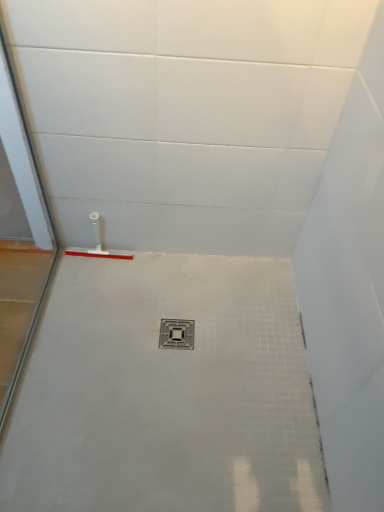
Locate an element on the screen. white plastic squeegee at left is located at coordinates [98, 244].

What do you see at coordinates (98, 244) in the screenshot? I see `white plastic squeegee at left` at bounding box center [98, 244].

The image size is (384, 512). In order to click on metallic gray drain at center in this screenshot , I will do `click(176, 334)`.

Describe the element at coordinates (176, 334) in the screenshot. I see `metallic gray drain at center` at that location.

This screenshot has height=512, width=384. In order to click on white plastic squeegee at left in this screenshot , I will do `click(98, 244)`.

Which object is positioned more to the left, metallic gray drain at center or white plastic squeegee at left?

white plastic squeegee at left.

Who is more distant, metallic gray drain at center or white plastic squeegee at left?

white plastic squeegee at left.

Considering the points (178, 332) and (96, 244), which point is behind, point (178, 332) or point (96, 244)?

The point (96, 244) is more distant.

From the image's perspective, is metallic gray drain at center located above or below white plastic squeegee at left?

metallic gray drain at center is below white plastic squeegee at left.

From a real-world perspective, which is physically above, metallic gray drain at center or white plastic squeegee at left?

In real-world perspective, white plastic squeegee at left is above.

Can you confirm if metallic gray drain at center is thinner than white plastic squeegee at left?

No.

Can you confirm if metallic gray drain at center is taller than white plastic squeegee at left?

No, metallic gray drain at center is not taller than white plastic squeegee at left.

Considering the sizes of objects metallic gray drain at center and white plastic squeegee at left in the image provided, who is bigger, metallic gray drain at center or white plastic squeegee at left?

white plastic squeegee at left is bigger.

Choose the correct answer: Is metallic gray drain at center inside white plastic squeegee at left or outside it?

metallic gray drain at center is spatially situated outside white plastic squeegee at left.

Are metallic gray drain at center and white plastic squeegee at left making contact?

No.

Is white plastic squeegee at left at the back of metallic gray drain at center?

metallic gray drain at center is not turned away from white plastic squeegee at left.

Measure the distance between metallic gray drain at center and white plastic squeegee at left.

A distance of 15.51 inches exists between metallic gray drain at center and white plastic squeegee at left.

You are a GUI agent. You are given a task and a screenshot of the screen. Output one action in this format:
    pyautogui.click(x=<x>, y=<y>)
    Task: Click on the shower behind the metallic gray drain at center
    
    Given the screenshot: What is the action you would take?
    pyautogui.click(x=98, y=244)

Is white plastic squeegee at left at the right side of metallic gray drain at center?

In fact, white plastic squeegee at left is to the left of metallic gray drain at center.

Considering their positions, is white plastic squeegee at left located in front of or behind metallic gray drain at center?

white plastic squeegee at left is positioned farther from the viewer than metallic gray drain at center.

Is point (93, 224) closer to camera compared to point (166, 328)?

No, (93, 224) is behind (166, 328).

From the image's perspective, relative to metallic gray drain at center, is white plastic squeegee at left above or below?

Based on their image positions, white plastic squeegee at left is located above metallic gray drain at center.

From a real-world perspective, is white plastic squeegee at left below metallic gray drain at center?

No.

Considering the relative sizes of white plastic squeegee at left and metallic gray drain at center in the image provided, is white plastic squeegee at left wider than metallic gray drain at center?

Incorrect, the width of white plastic squeegee at left does not surpass that of metallic gray drain at center.

Between white plastic squeegee at left and metallic gray drain at center, which one has more height?

With more height is white plastic squeegee at left.

Is white plastic squeegee at left smaller than metallic gray drain at center?

No.

Is white plastic squeegee at left located outside metallic gray drain at center?

Yes.

Is white plastic squeegee at left next to metallic gray drain at center?

white plastic squeegee at left is not next to metallic gray drain at center, and they're not touching.

Could you tell me if white plastic squeegee at left is facing metallic gray drain at center?

No, white plastic squeegee at left does not turn towards metallic gray drain at center.

In order to click on shower to the left of metallic gray drain at center in this screenshot , I will do `click(98, 244)`.

This screenshot has height=512, width=384. In order to click on plumbing fixture in front of the white plastic squeegee at left in this screenshot , I will do `click(176, 334)`.

Where is `plumbing fixture located on the right of white plastic squeegee at left`? plumbing fixture located on the right of white plastic squeegee at left is located at coordinates (176, 334).